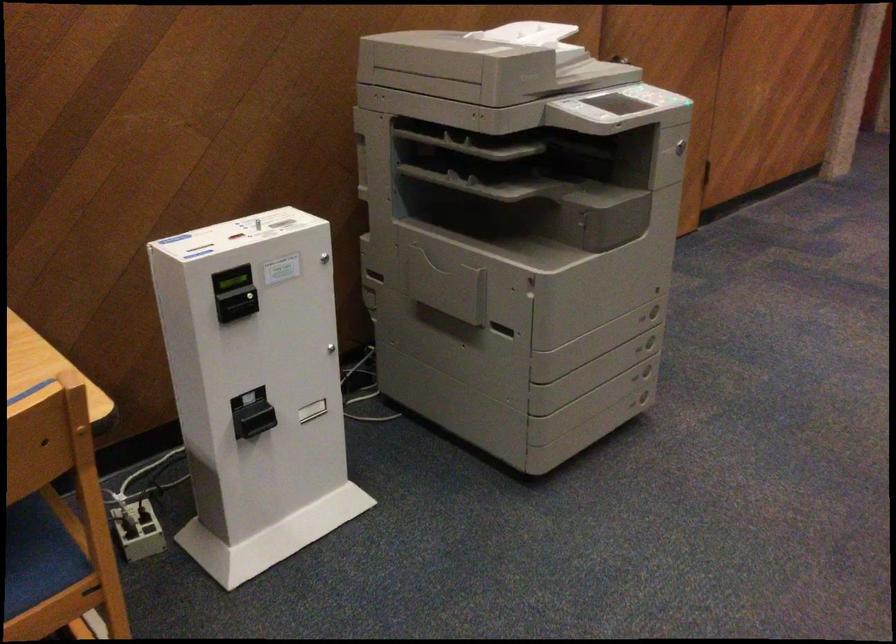
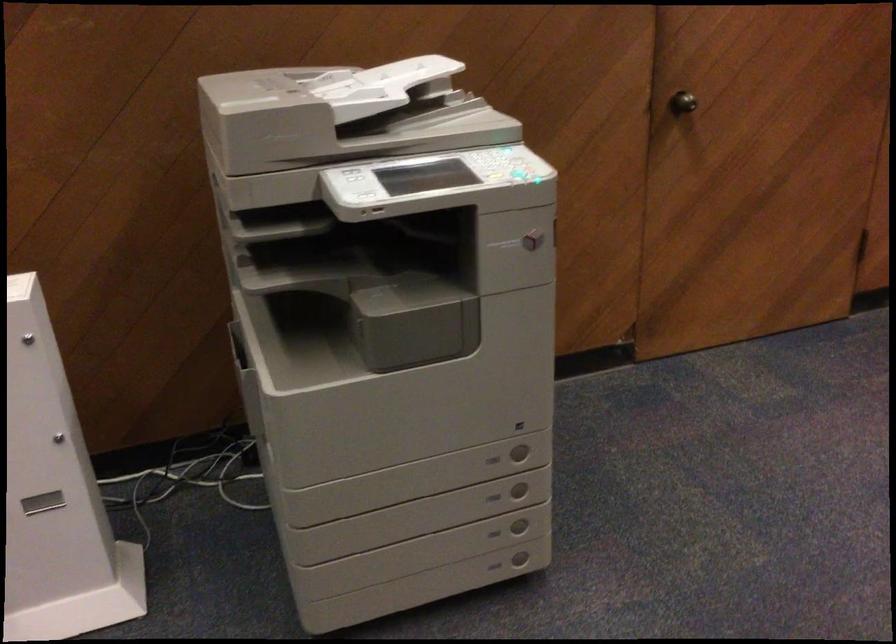
Find the pixel in the second image that matches [670,98] in the first image.

(521, 176)